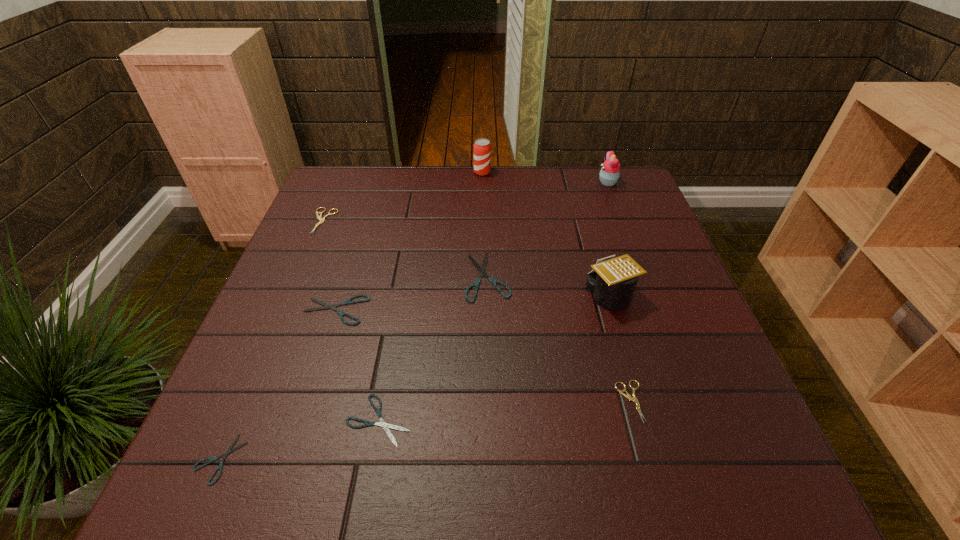
This screenshot has width=960, height=540. I want to click on vacant area that lies between the farthest shears and the smaller beige shears, so click(477, 311).

Locate an element on the screen. vacant area that lies between the leftmost black shears and the smaller beige shears is located at coordinates (425, 430).

At what (x,y) coordinates should I click in order to perform the action: click on free area in between the biggest black shears and the orange beer can. Please return your answer as a coordinate pair (x, y). The height and width of the screenshot is (540, 960). Looking at the image, I should click on (485, 225).

This screenshot has width=960, height=540. Find the location of `vacant area that lies between the third shears from right to left and the farther beige shears`. vacant area that lies between the third shears from right to left and the farther beige shears is located at coordinates (351, 320).

You are a GUI agent. You are given a task and a screenshot of the screen. Output one action in this format:
    pyautogui.click(x=<x>, y=<y>)
    Task: Click on the vacant region between the farthest shears and the fifth shears from left to right
    Image resolution: width=960 pixels, height=540 pixels.
    Given the screenshot: What is the action you would take?
    pyautogui.click(x=406, y=249)

Locate an element on the screen. This screenshot has width=960, height=540. empty location between the rightmost object and the biggest black shears is located at coordinates (548, 230).

The height and width of the screenshot is (540, 960). In order to click on vacant space that is in between the bigger beige shears and the cupcake in this screenshot , I will do `click(466, 201)`.

Identify the location of vacant area between the farthest shears and the calculator. This screenshot has width=960, height=540. (467, 258).

Find the location of a particular element. Image resolution: width=960 pixels, height=540 pixels. empty space that is in between the biggest black shears and the rightmost object is located at coordinates (548, 230).

Locate an element on the screen. vacant space in between the shortest object and the biggest black shears is located at coordinates (354, 368).